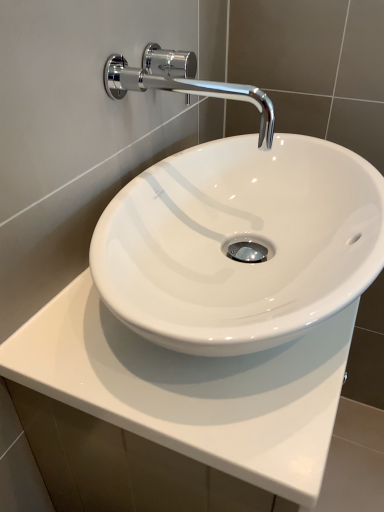
What do you see at coordinates (187, 402) in the screenshot? I see `white glossy countertop at center` at bounding box center [187, 402].

Identify the location of white glossy countertop at center. (187, 402).

This screenshot has height=512, width=384. Describe the element at coordinates (182, 82) in the screenshot. I see `chrome/metallic faucet at upper center` at that location.

Identify the location of chrome/metallic faucet at upper center. (182, 82).

What are the coordinates of `white glossy countertop at center` in the screenshot? It's located at (187, 402).

Can you confirm if white glossy countertop at center is positioned to the right of chrome/metallic faucet at upper center?

Correct, you'll find white glossy countertop at center to the right of chrome/metallic faucet at upper center.

In the image, is white glossy countertop at center positioned in front of or behind chrome/metallic faucet at upper center?

Visually, white glossy countertop at center is located in front of chrome/metallic faucet at upper center.

Is point (264, 441) in front of point (117, 93)?

Yes, it is in front of point (117, 93).

From the image's perspective, which is below, white glossy countertop at center or chrome/metallic faucet at upper center?

white glossy countertop at center appears lower in the image.

From a real-world perspective, between white glossy countertop at center and chrome/metallic faucet at upper center, who is vertically lower?

white glossy countertop at center is physically lower.

Considering the sizes of objects white glossy countertop at center and chrome/metallic faucet at upper center in the image provided, who is thinner, white glossy countertop at center or chrome/metallic faucet at upper center?

chrome/metallic faucet at upper center.

Between white glossy countertop at center and chrome/metallic faucet at upper center, which one has more height?

With more height is white glossy countertop at center.

Considering the sizes of objects white glossy countertop at center and chrome/metallic faucet at upper center in the image provided, who is smaller, white glossy countertop at center or chrome/metallic faucet at upper center?

Smaller between the two is chrome/metallic faucet at upper center.

Is white glossy countertop at center inside the boundaries of chrome/metallic faucet at upper center, or outside?

white glossy countertop at center lies outside chrome/metallic faucet at upper center.

Are white glossy countertop at center and chrome/metallic faucet at upper center beside each other?

No, white glossy countertop at center is not in contact with chrome/metallic faucet at upper center.

Is white glossy countertop at center facing towards chrome/metallic faucet at upper center?

No, white glossy countertop at center is not oriented towards chrome/metallic faucet at upper center.

In order to click on counter top located below the chrome/metallic faucet at upper center (from the image's perspective) in this screenshot , I will do `click(187, 402)`.

Between chrome/metallic faucet at upper center and white glossy countertop at center, which one appears on the right side from the viewer's perspective?

From the viewer's perspective, white glossy countertop at center appears more on the right side.

Which object is closer to the camera, chrome/metallic faucet at upper center or white glossy countertop at center?

Positioned in front is white glossy countertop at center.

Does point (117, 75) come farther from viewer compared to point (66, 354)?

Yes, point (117, 75) is behind point (66, 354).

From the image's perspective, which one is positioned lower, chrome/metallic faucet at upper center or white glossy countertop at center?

white glossy countertop at center is shown below in the image.

From a real-world perspective, is chrome/metallic faucet at upper center positioned over white glossy countertop at center based on gravity?

Correct, in the physical world, chrome/metallic faucet at upper center is higher than white glossy countertop at center.

Which of these two, chrome/metallic faucet at upper center or white glossy countertop at center, is thinner?

With smaller width is chrome/metallic faucet at upper center.

Considering the relative sizes of chrome/metallic faucet at upper center and white glossy countertop at center in the image provided, is chrome/metallic faucet at upper center shorter than white glossy countertop at center?

Indeed, chrome/metallic faucet at upper center has a lesser height compared to white glossy countertop at center.

Looking at the image, does chrome/metallic faucet at upper center seem bigger or smaller compared to white glossy countertop at center?

Clearly, chrome/metallic faucet at upper center is smaller in size than white glossy countertop at center.

In the scene shown: Would you say white glossy countertop at center is part of chrome/metallic faucet at upper center's contents?

No, chrome/metallic faucet at upper center does not contain white glossy countertop at center.

Can you see chrome/metallic faucet at upper center touching white glossy countertop at center?

chrome/metallic faucet at upper center and white glossy countertop at center are clearly separated.

Is white glossy countertop at center at the back of chrome/metallic faucet at upper center?

That's not correct — chrome/metallic faucet at upper center is not looking away from white glossy countertop at center.

What's the angular difference between chrome/metallic faucet at upper center and white glossy countertop at center's facing directions?

The facing directions of chrome/metallic faucet at upper center and white glossy countertop at center are 1.81 degrees apart.

How far apart are chrome/metallic faucet at upper center and white glossy countertop at center?

They are 15.92 inches apart.

I want to click on tap above the white glossy countertop at center (from a real-world perspective), so click(x=182, y=82).

Where is `counter top that appears in front of the chrome/metallic faucet at upper center`? This screenshot has height=512, width=384. counter top that appears in front of the chrome/metallic faucet at upper center is located at coordinates (187, 402).

This screenshot has width=384, height=512. Identify the location of counter top below the chrome/metallic faucet at upper center (from a real-world perspective). (187, 402).